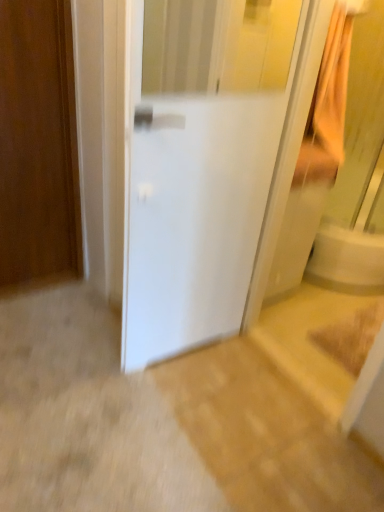
Locate an element on the screen. white matte refrigerator at center, the 1th door viewed from the right is located at coordinates (203, 180).

What do you see at coordinates (203, 180) in the screenshot? The height and width of the screenshot is (512, 384). I see `white matte refrigerator at center, the second door positioned from the left` at bounding box center [203, 180].

The width and height of the screenshot is (384, 512). In order to click on wooden door at left, the second door when ordered from right to left in this screenshot , I will do `click(38, 145)`.

The width and height of the screenshot is (384, 512). Describe the element at coordinates (38, 145) in the screenshot. I see `wooden door at left, the second door when ordered from right to left` at that location.

Measure the distance between point (2, 99) and camera.

1.86 meters.

Identify the location of white matte refrigerator at center, the second door positioned from the left. The image size is (384, 512). (203, 180).

Is white matte refrigerator at center, the second door positioned from the left, to the left of wooden door at left, the second door when ordered from right to left, from the viewer's perspective?

In fact, white matte refrigerator at center, the second door positioned from the left, is to the right of wooden door at left, the second door when ordered from right to left.

Is white matte refrigerator at center, the 1th door viewed from the right, positioned in front of wooden door at left, the second door when ordered from right to left?

Yes, white matte refrigerator at center, the 1th door viewed from the right, is closer to the camera.

Is point (255, 42) more distant than point (45, 137)?

That is True.

From the image's perspective, which is below, white matte refrigerator at center, the 1th door viewed from the right, or wooden door at left, the second door when ordered from right to left?

white matte refrigerator at center, the 1th door viewed from the right, appears lower in the image.

From a real-world perspective, which is physically above, white matte refrigerator at center, the 1th door viewed from the right, or wooden door at left, acting as the first door starting from the left?

white matte refrigerator at center, the 1th door viewed from the right, from a real-world perspective.

Can you confirm if white matte refrigerator at center, the 1th door viewed from the right, is thinner than wooden door at left, acting as the first door starting from the left?

No.

From their relative heights in the image, would you say white matte refrigerator at center, the second door positioned from the left, is taller or shorter than wooden door at left, the second door when ordered from right to left?

Clearly, white matte refrigerator at center, the second door positioned from the left, is taller compared to wooden door at left, the second door when ordered from right to left.

Can you confirm if white matte refrigerator at center, the 1th door viewed from the right, is bigger than wooden door at left, the second door when ordered from right to left?

Yes.

Is white matte refrigerator at center, the second door positioned from the left, completely or partially outside of wooden door at left, the second door when ordered from right to left?

Absolutely, white matte refrigerator at center, the second door positioned from the left, is external to wooden door at left, the second door when ordered from right to left.

Is white matte refrigerator at center, the second door positioned from the left, directly adjacent to wooden door at left, the second door when ordered from right to left?

No, white matte refrigerator at center, the second door positioned from the left, is not beside wooden door at left, the second door when ordered from right to left.

Is white matte refrigerator at center, the second door positioned from the left, facing away from wooden door at left, acting as the first door starting from the left?

Yes, white matte refrigerator at center, the second door positioned from the left, is positioned with its back facing wooden door at left, acting as the first door starting from the left.

Measure the distance between white matte refrigerator at center, the second door positioned from the left, and wooden door at left, acting as the first door starting from the left.

The distance of white matte refrigerator at center, the second door positioned from the left, from wooden door at left, acting as the first door starting from the left, is 34.27 inches.

At what (x,y) coordinates should I click in order to perform the action: click on door above the white matte refrigerator at center, the 1th door viewed from the right (from the image's perspective). Please return your answer as a coordinate pair (x, y). Looking at the image, I should click on (38, 145).

Which is more to the left, wooden door at left, the second door when ordered from right to left, or white matte refrigerator at center, the 1th door viewed from the right?

wooden door at left, the second door when ordered from right to left, is more to the left.

Relative to white matte refrigerator at center, the second door positioned from the left, is wooden door at left, acting as the first door starting from the left, in front or behind?

Clearly, wooden door at left, acting as the first door starting from the left, is behind white matte refrigerator at center, the second door positioned from the left.

Which point is more distant from viewer, (66,219) or (125,319)?

The point (66,219) is more distant.

From the image's perspective, is wooden door at left, acting as the first door starting from the left, below white matte refrigerator at center, the second door positioned from the left?

Incorrect, from the image's perspective, wooden door at left, acting as the first door starting from the left, is higher than white matte refrigerator at center, the second door positioned from the left.

From a real-world perspective, is wooden door at left, acting as the first door starting from the left, positioned over white matte refrigerator at center, the 1th door viewed from the right, based on gravity?

Incorrect, from a real-world perspective, wooden door at left, acting as the first door starting from the left, is lower than white matte refrigerator at center, the 1th door viewed from the right.

Does wooden door at left, the second door when ordered from right to left, have a greater width compared to white matte refrigerator at center, the 1th door viewed from the right?

In fact, wooden door at left, the second door when ordered from right to left, might be narrower than white matte refrigerator at center, the 1th door viewed from the right.

Considering the relative sizes of wooden door at left, acting as the first door starting from the left, and white matte refrigerator at center, the 1th door viewed from the right, in the image provided, is wooden door at left, acting as the first door starting from the left, shorter than white matte refrigerator at center, the 1th door viewed from the right,?

Correct, wooden door at left, acting as the first door starting from the left, is not as tall as white matte refrigerator at center, the 1th door viewed from the right.

Is wooden door at left, acting as the first door starting from the left, smaller than white matte refrigerator at center, the second door positioned from the left?

Correct, wooden door at left, acting as the first door starting from the left, occupies less space than white matte refrigerator at center, the second door positioned from the left.

Is white matte refrigerator at center, the second door positioned from the left, inside wooden door at left, the second door when ordered from right to left?

No, wooden door at left, the second door when ordered from right to left, does not contain white matte refrigerator at center, the second door positioned from the left.

Is there a large distance between wooden door at left, the second door when ordered from right to left, and white matte refrigerator at center, the second door positioned from the left?

No, wooden door at left, the second door when ordered from right to left, is not far away from white matte refrigerator at center, the second door positioned from the left.

Does wooden door at left, the second door when ordered from right to left, turn towards white matte refrigerator at center, the 1th door viewed from the right?

No, wooden door at left, the second door when ordered from right to left, is not facing towards white matte refrigerator at center, the 1th door viewed from the right.

How different are the orientations of wooden door at left, acting as the first door starting from the left, and white matte refrigerator at center, the 1th door viewed from the right, in degrees?

The facing directions of wooden door at left, acting as the first door starting from the left, and white matte refrigerator at center, the 1th door viewed from the right, are 2.71 degrees apart.

At what (x,y) coordinates should I click in order to perform the action: click on door below the white matte refrigerator at center, the 1th door viewed from the right (from a real-world perspective). Please return your answer as a coordinate pair (x, y). This screenshot has width=384, height=512. Looking at the image, I should click on [x=38, y=145].

Where is `door on the left of white matte refrigerator at center, the second door positioned from the left`? door on the left of white matte refrigerator at center, the second door positioned from the left is located at coordinates (38, 145).

I want to click on door above the white matte refrigerator at center, the 1th door viewed from the right (from the image's perspective), so click(x=38, y=145).